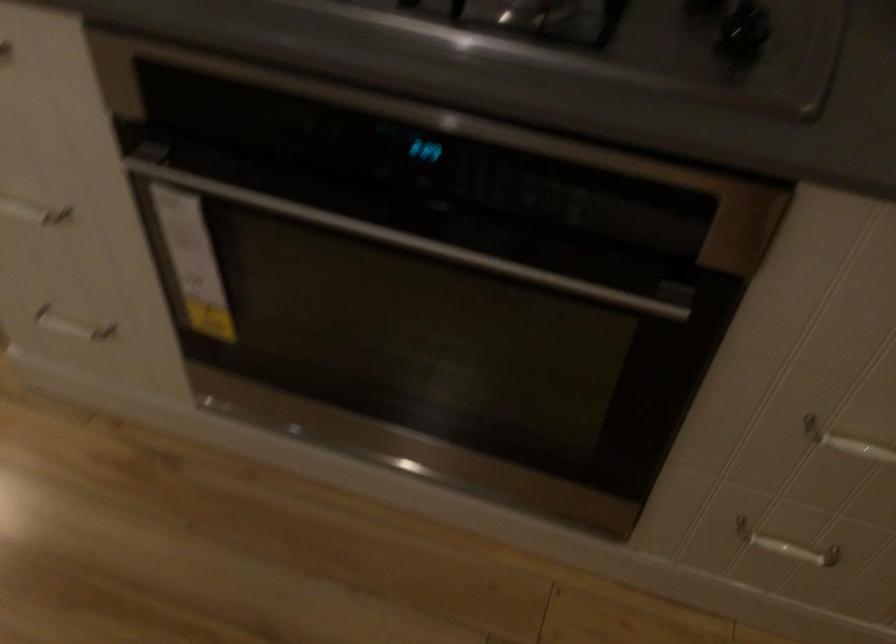
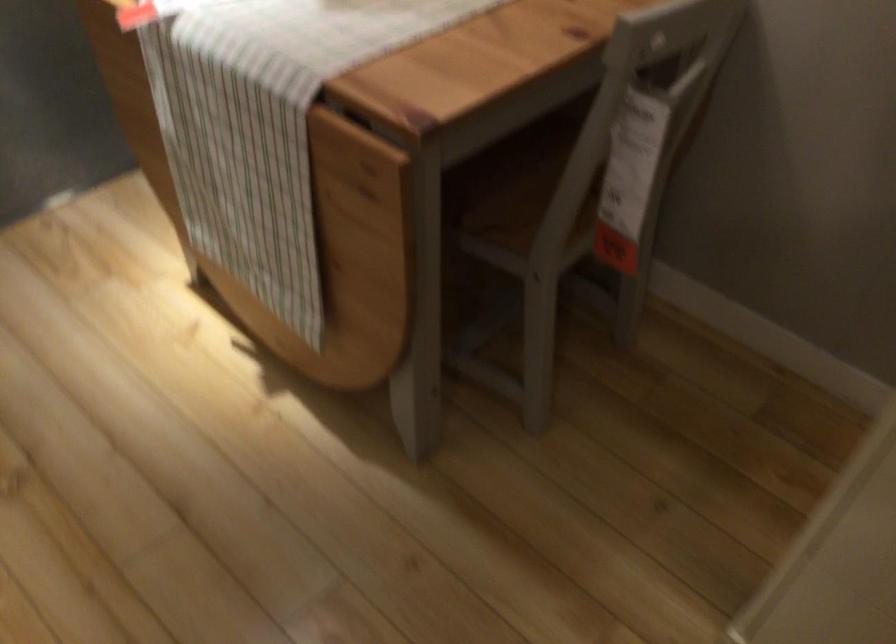
Question: The first image is from the beginning of the video and the second image is from the end. How did the camera likely rotate when shooting the video?

Choices:
 (A) Left
 (B) Right
 (C) Up
 (D) Down

Answer: (A)